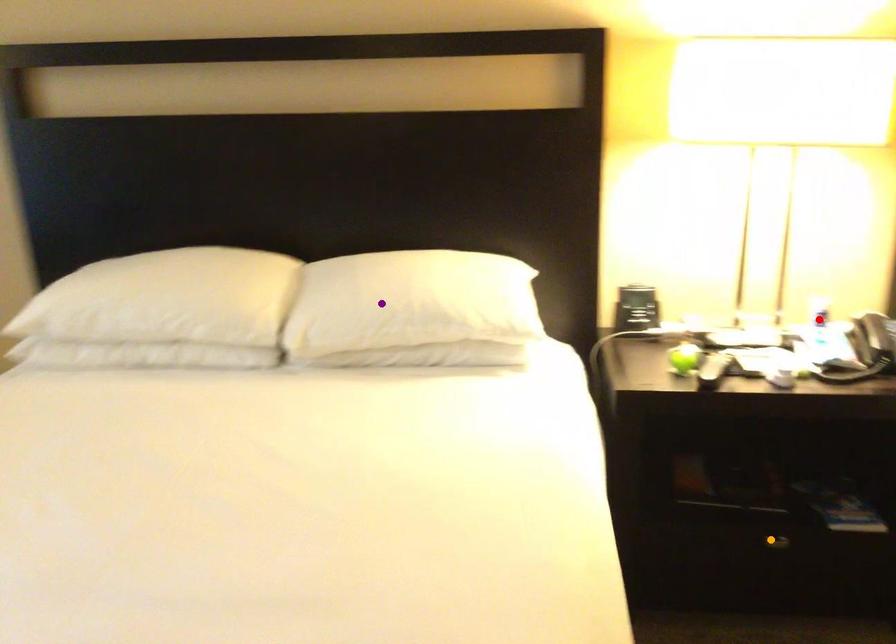
Order these from nearest to farthest:
red point, orange point, purple point

orange point, purple point, red point